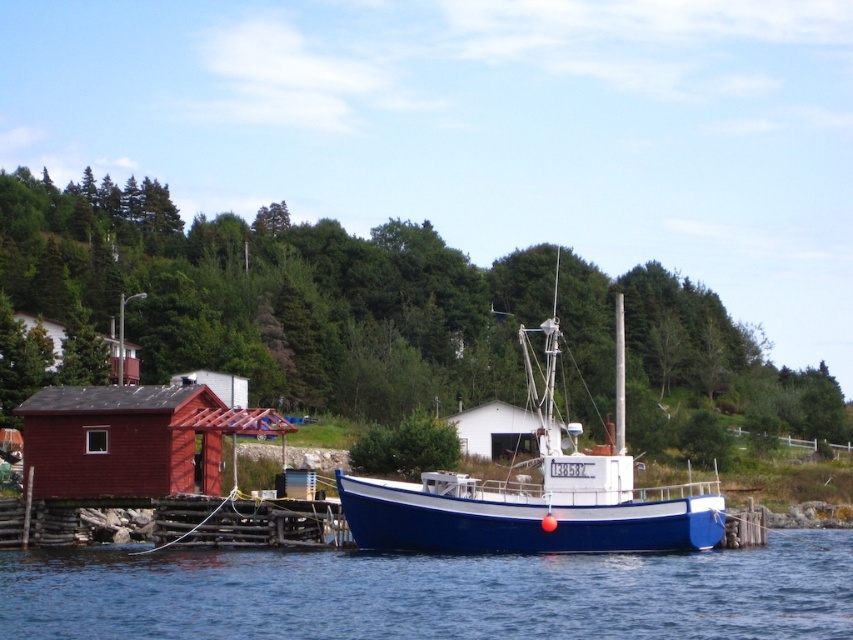
Question: Which of these objects is positioned farthest from the white matte hut at center?

Choices:
 (A) blue matte boat at center
 (B) blue water at center

Answer: (B)

Question: Can you confirm if green leafy tree at center is bigger than smooth red cabin at lower left?

Choices:
 (A) no
 (B) yes

Answer: (B)

Question: Which point appears farthest from the camera in this image?

Choices:
 (A) (36, 632)
 (B) (506, 419)

Answer: (B)

Question: Does green leafy tree at center have a lesser width compared to blue matte boat at center?

Choices:
 (A) yes
 (B) no

Answer: (B)

Question: Which object appears farthest from the camera in this image?

Choices:
 (A) white matte hut at center
 (B) green leafy tree at center

Answer: (B)

Question: Can you confirm if blue matte boat at center is bigger than white matte hut at center?

Choices:
 (A) no
 (B) yes

Answer: (B)